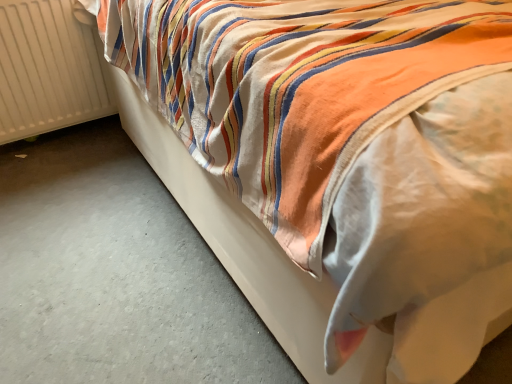
This screenshot has width=512, height=384. Identify the location of free space above white smooth concrete at lower left (from a real-world perspective). (104, 237).